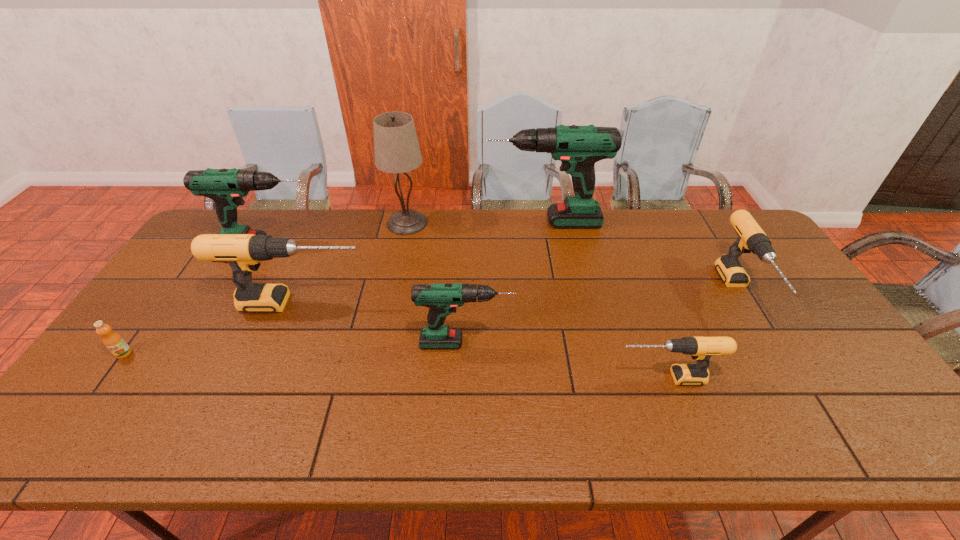
What are the coordinates of `vacant region located 0.210m on the handle side of the second biggest black drill` in the screenshot? It's located at (808, 406).

Find the location of a particular element. The height and width of the screenshot is (540, 960). vacant area situated 0.090m on the handle side of the nearest black drill is located at coordinates point(579,377).

At what (x,y) coordinates should I click in order to perform the action: click on vacant region located on the handle side of the nearest black drill. Please return your answer as a coordinate pair (x, y). Image resolution: width=960 pixels, height=540 pixels. Looking at the image, I should click on (575, 377).

The width and height of the screenshot is (960, 540). In order to click on vacant area situated 0.150m on the handle side of the nearest black drill in this screenshot , I will do `click(555, 377)`.

Find the location of a particular element. vacant space located 0.080m on the front label of the orange juice is located at coordinates (100, 386).

The image size is (960, 540). I want to click on lampshade located in the far edge section of the desktop, so click(x=396, y=147).

The height and width of the screenshot is (540, 960). Find the location of `drill that is at the left edge`. drill that is at the left edge is located at coordinates (226, 187).

This screenshot has width=960, height=540. I want to click on orange juice that is at the left edge, so [x=113, y=341].

Where is `object located at the right edge`? This screenshot has width=960, height=540. object located at the right edge is located at coordinates (751, 238).

Where is `object present at the far left corner`? Image resolution: width=960 pixels, height=540 pixels. object present at the far left corner is located at coordinates (226, 187).